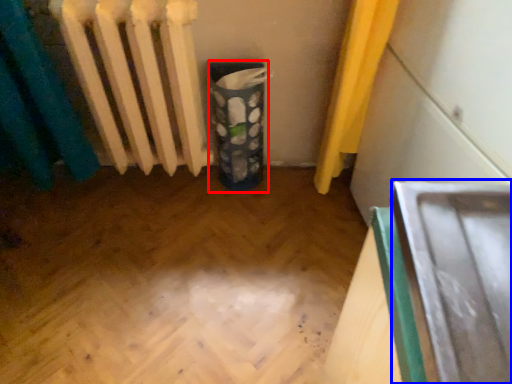
Question: Which point is closer to the camera, recycling bin (highlighted by a red box) or wide (highlighted by a blue box)?

Choices:
 (A) recycling bin
 (B) wide

Answer: (B)